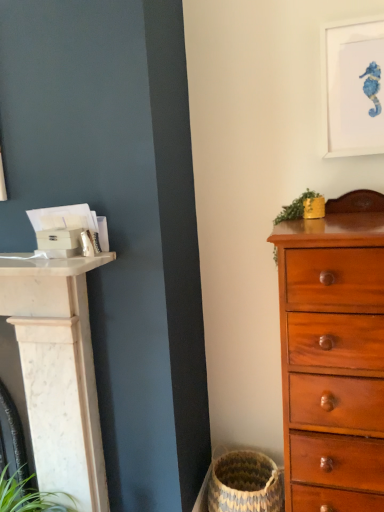
Question: Considering the relative sizes of white matte picture frame at upper right and natural woven basket at lower center in the image provided, is white matte picture frame at upper right taller than natural woven basket at lower center?

Choices:
 (A) no
 (B) yes

Answer: (B)

Question: Is white matte picture frame at upper right shorter than natural woven basket at lower center?

Choices:
 (A) yes
 (B) no

Answer: (B)

Question: Can you confirm if white matte picture frame at upper right is positioned to the left of natural woven basket at lower center?

Choices:
 (A) no
 (B) yes

Answer: (A)

Question: From the image's perspective, is white matte picture frame at upper right located beneath natural woven basket at lower center?

Choices:
 (A) yes
 (B) no

Answer: (B)

Question: Is white matte picture frame at upper right smaller than natural woven basket at lower center?

Choices:
 (A) yes
 (B) no

Answer: (A)

Question: From a real-world perspective, is white matte picture frame at upper right positioned under natural woven basket at lower center based on gravity?

Choices:
 (A) no
 (B) yes

Answer: (A)

Question: Can you confirm if natural woven basket at lower center is shorter than mahogany wooden chest of drawers at right?

Choices:
 (A) yes
 (B) no

Answer: (A)

Question: From a real-world perspective, is natural woven basket at lower center physically below mahogany wooden chest of drawers at right?

Choices:
 (A) yes
 (B) no

Answer: (A)

Question: Does natural woven basket at lower center have a larger size compared to mahogany wooden chest of drawers at right?

Choices:
 (A) yes
 (B) no

Answer: (B)

Question: Considering the relative sizes of natural woven basket at lower center and mahogany wooden chest of drawers at right in the image provided, is natural woven basket at lower center wider than mahogany wooden chest of drawers at right?

Choices:
 (A) yes
 (B) no

Answer: (B)

Question: From the image's perspective, is natural woven basket at lower center under mahogany wooden chest of drawers at right?

Choices:
 (A) no
 (B) yes

Answer: (B)

Question: Considering the relative positions of natural woven basket at lower center and mahogany wooden chest of drawers at right in the image provided, is natural woven basket at lower center to the left of mahogany wooden chest of drawers at right from the viewer's perspective?

Choices:
 (A) no
 (B) yes

Answer: (B)

Question: Is white matte picture frame at upper right far from green leafy plant at upper right?

Choices:
 (A) yes
 (B) no

Answer: (B)